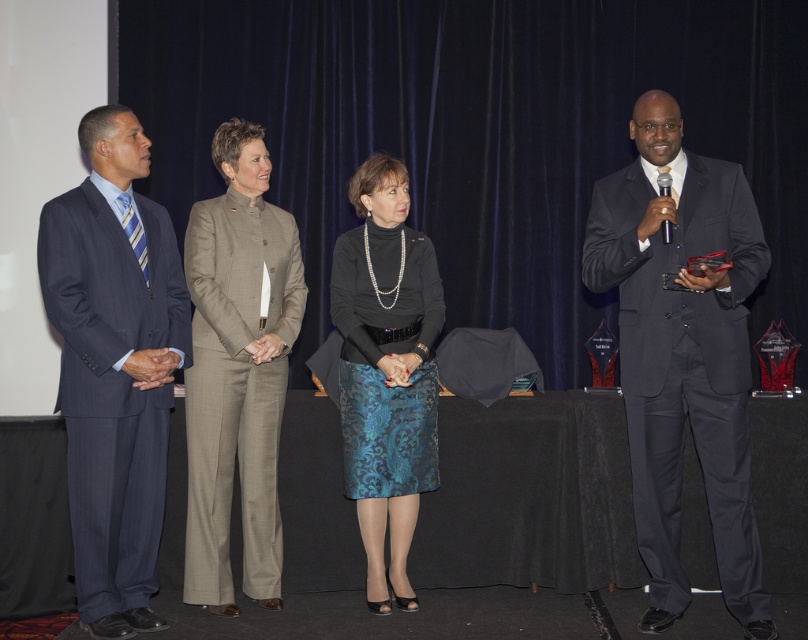
You are a photographer at the event. You need to adjust the lighting so that the matte black suit at right and the beige woolen suit at center are both well illuminated. Which suit requires more light adjustment because of its color?

The matte black suit at right requires more light adjustment because black absorbs more light and may appear underexposed without additional lighting.

You are an event planner arranging a photo shoot. You need to position two models wearing the matte black suit at right and the matte black blouse at center. According to the scene description, which model should be placed to the right of the other?

The matte black suit at right should be placed to the right of the matte black blouse at center.

You are an event planner arranging a photo shoot for the formal event. You need to place a small decorative accessory between the matte black suit at right and the matte black blouse at center. Based on their sizes, which object should the accessory be closer to?

The matte black suit at right is larger than the matte black blouse at center, so the accessory should be placed closer to the matte black blouse at center to balance the composition.